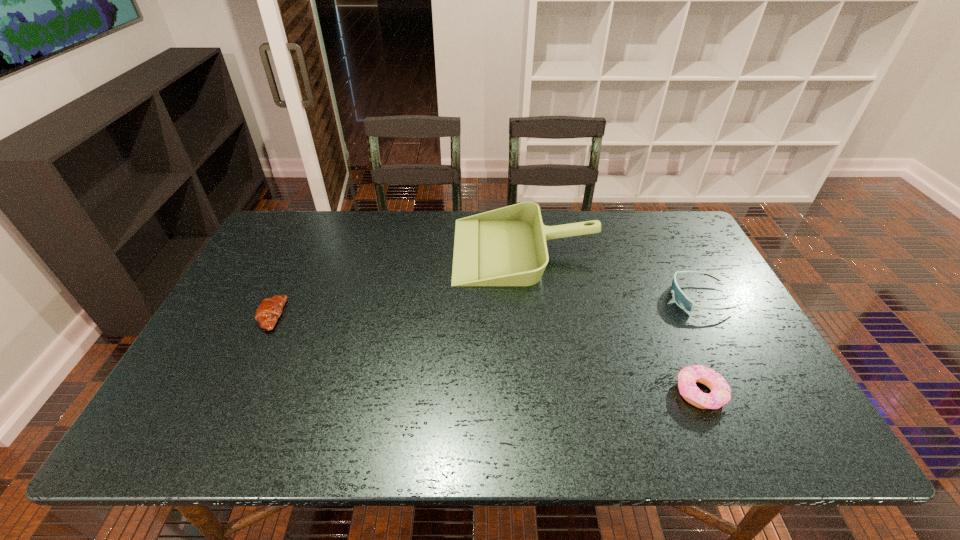
Locate an element on the screen. The height and width of the screenshot is (540, 960). blank region between the second tallest object and the leftmost object is located at coordinates (485, 307).

The height and width of the screenshot is (540, 960). In order to click on vacant area between the dustpan and the goggles in this screenshot , I will do `click(612, 274)`.

At what (x,y) coordinates should I click in order to perform the action: click on blank region between the nearest object and the second tallest object. Please return your answer as a coordinate pair (x, y). The image size is (960, 540). Looking at the image, I should click on [699, 346].

Identify the location of blank region between the goggles and the dustpan. This screenshot has width=960, height=540. (612, 274).

Select which object appears as the third closest to the goggles. Please provide its 2D coordinates. Your answer should be formatted as a tuple, i.e. [(x, y)], where the tuple contains the x and y coordinates of a point satisfying the conditions above.

[(269, 310)]

Choose which object is the nearest neighbor to the goggles. Please provide its 2D coordinates. Your answer should be formatted as a tuple, i.e. [(x, y)], where the tuple contains the x and y coordinates of a point satisfying the conditions above.

[(507, 246)]

Find the location of a particular element. This screenshot has width=960, height=540. free location that satisfies the following two spatial constraints: 1. on the scoop of the tallest object; 2. on the left side of the nearest object is located at coordinates (542, 393).

Locate an element on the screen. This screenshot has width=960, height=540. vacant point that satisfies the following two spatial constraints: 1. on the front-facing side of the goggles; 2. on the front side of the nearest object is located at coordinates (748, 393).